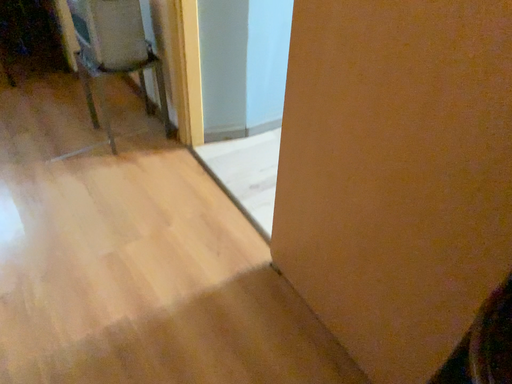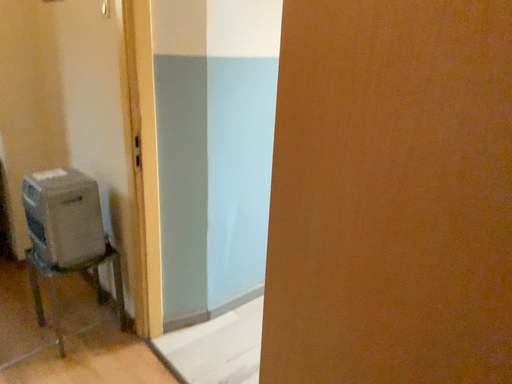
Question: Which way did the camera rotate in the video?

Choices:
 (A) rotated downward
 (B) rotated upward

Answer: (B)